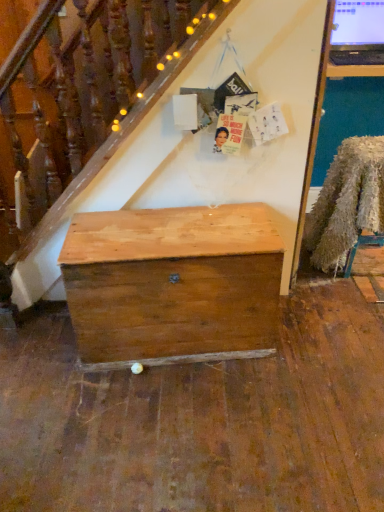
Question: From the image's perspective, is fuzzy fabric chair at right above or below natural wood chest at center?

Choices:
 (A) below
 (B) above

Answer: (B)

Question: Considering the positions of fuzzy fabric chair at right and natural wood chest at center in the image, is fuzzy fabric chair at right taller or shorter than natural wood chest at center?

Choices:
 (A) tall
 (B) short

Answer: (A)

Question: Is point (377, 194) closer or farther from the camera than point (162, 280)?

Choices:
 (A) farther
 (B) closer

Answer: (A)

Question: From their relative heights in the image, would you say natural wood chest at center is taller or shorter than fuzzy fabric chair at right?

Choices:
 (A) short
 (B) tall

Answer: (A)

Question: Looking at their shapes, would you say natural wood chest at center is wider or thinner than fuzzy fabric chair at right?

Choices:
 (A) thin
 (B) wide

Answer: (A)

Question: Which is correct: natural wood chest at center is inside fuzzy fabric chair at right, or outside of it?

Choices:
 (A) inside
 (B) outside

Answer: (B)

Question: Is natural wood chest at center bigger or smaller than fuzzy fabric chair at right?

Choices:
 (A) small
 (B) big

Answer: (B)